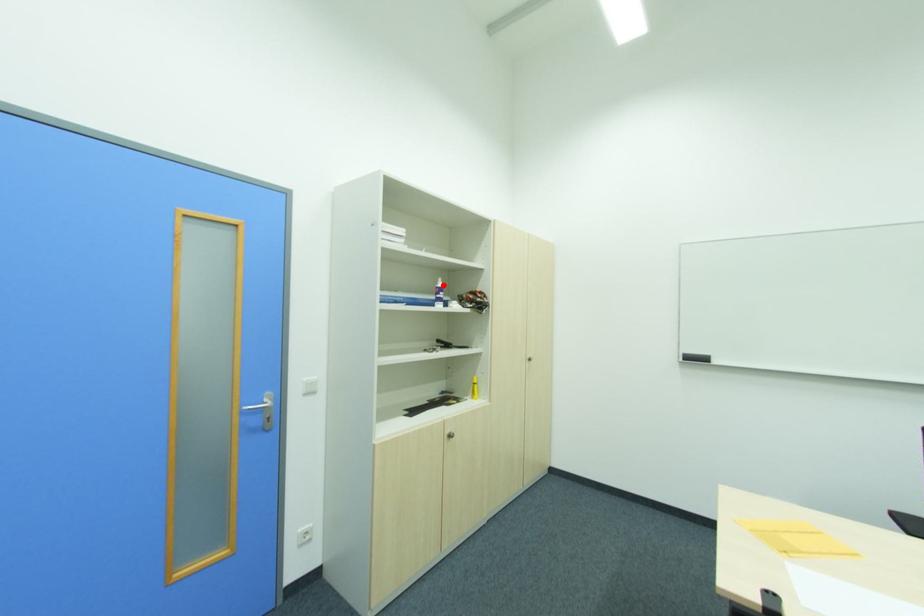
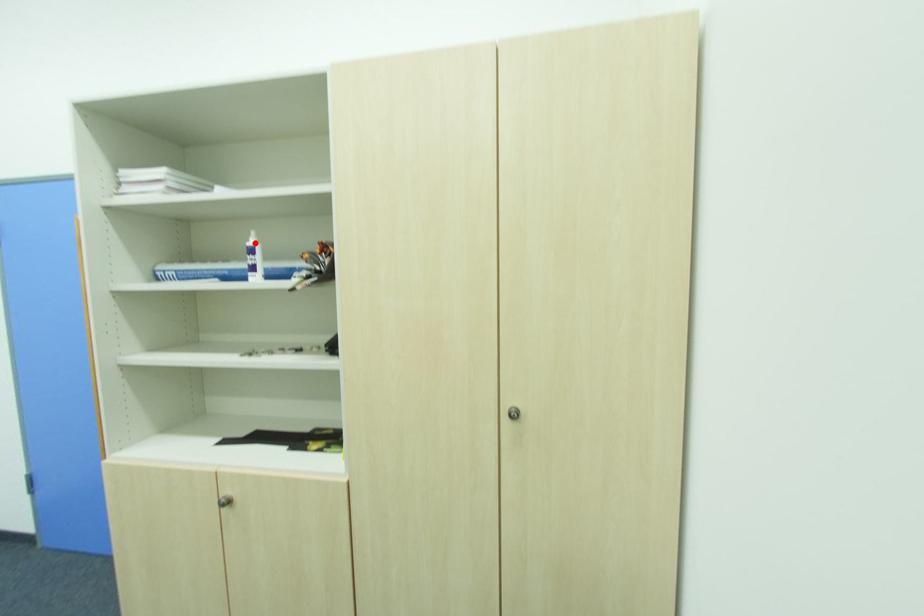
I am providing you with two images of the same scene from different viewpoints. A red point is marked on the first image and another point is marked on the second image. Is the red point in image1 aligned with the point shown in image2?

Yes